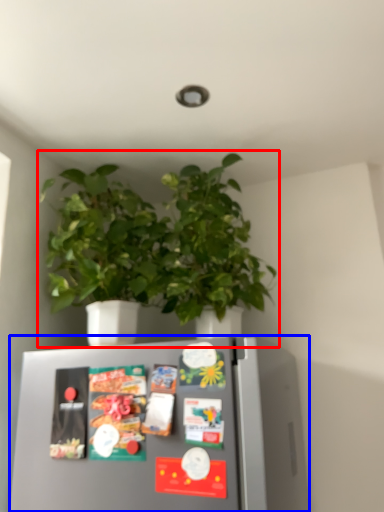
Question: Which object appears farthest to the camera in this image, houseplant (highlighted by a red box) or refrigerator (highlighted by a blue box)?

Choices:
 (A) houseplant
 (B) refrigerator

Answer: (A)